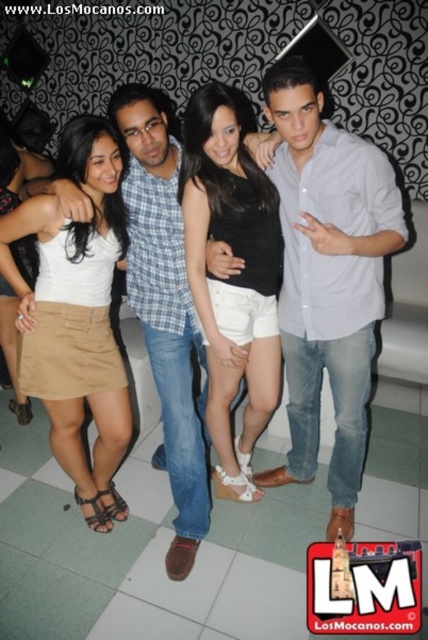
Does black matte shorts at center appear on the right side of matte khaki skirt at center?

Yes, black matte shorts at center is to the right of matte khaki skirt at center.

Between black matte shorts at center and matte khaki skirt at center, which one appears on the right side from the viewer's perspective?

Positioned to the right is black matte shorts at center.

Is point (259, 337) closer to camera compared to point (109, 513)?

That is True.

Locate an element on the screen. black matte shorts at center is located at coordinates (231, 280).

The width and height of the screenshot is (428, 640). What are the coordinates of `light blue shirt at center` in the screenshot? It's located at (326, 276).

Is point (312, 326) farther from viewer compared to point (80, 340)?

No, it is not.

Locate an element on the screen. light blue shirt at center is located at coordinates (326, 276).

Between light blue shirt at center and black matte shorts at center, which one appears on the left side from the viewer's perspective?

Positioned to the left is black matte shorts at center.

Can you confirm if light blue shirt at center is wider than black matte shorts at center?

Yes.

Image resolution: width=428 pixels, height=640 pixels. Describe the element at coordinates (326, 276) in the screenshot. I see `light blue shirt at center` at that location.

What are the coordinates of `light blue shirt at center` in the screenshot? It's located at (x=326, y=276).